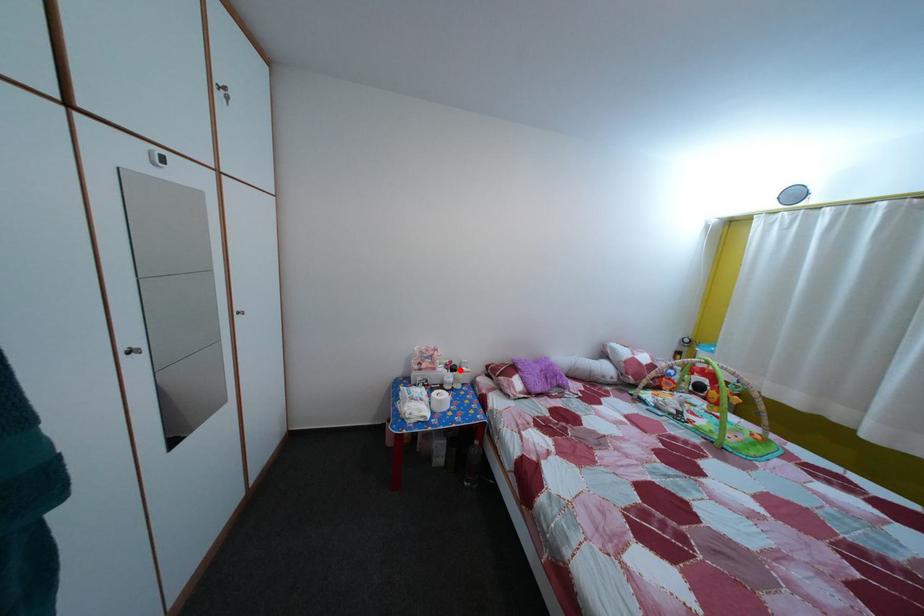
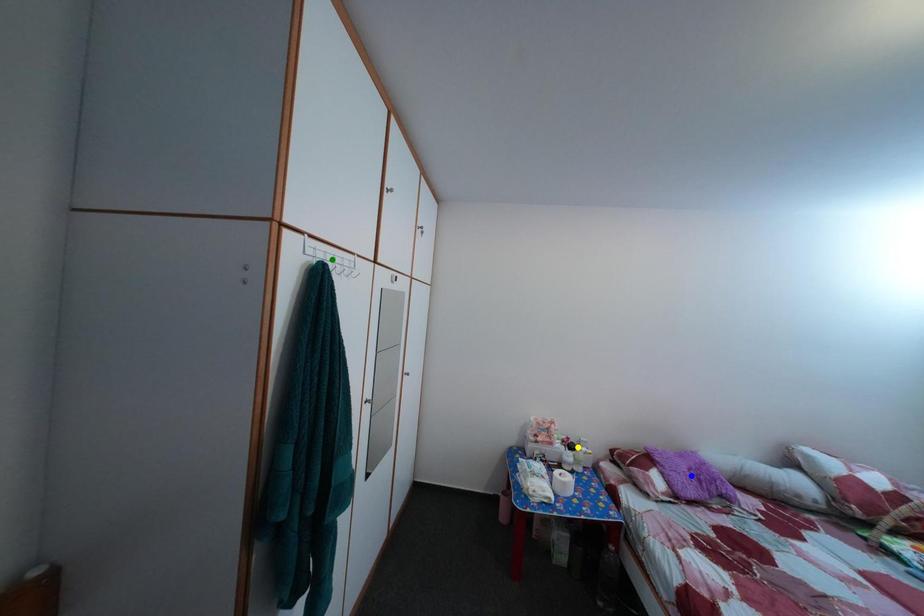
Question: I am providing you with two images of the same scene from different viewpoints. A red point is marked on the first image. You are given multiple points on the second image. Which mark in image 2 goes with the point in image 1?

Choices:
 (A) yellow point
 (B) green point
 (C) blue point

Answer: (A)